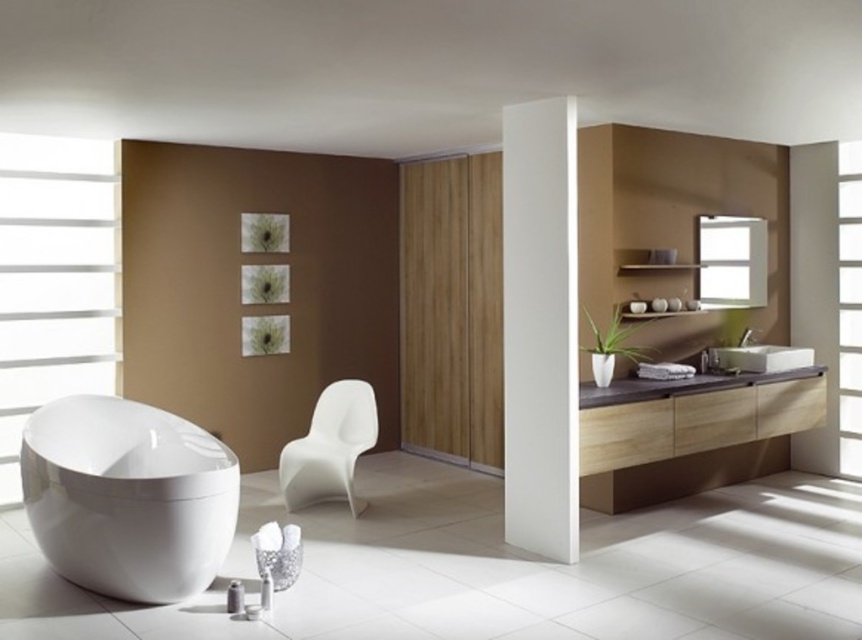
You are designing a bathroom and want to place a large potted plant in the room. Considering the white matte window at left and the transparent glass window at upper right, which window should you place the plant near to ensure it gets more sunlight?

The transparent glass window at upper right allows more sunlight since it is transparent, while the white matte window at left may block some light due to its matte finish. However, the white matte window at left is larger in size, potentially providing a broader area for light distribution. To determine the best location, consider the plant species and its light requirements. If it requires direct sunlight, the transparent glass window at upper right is preferable. If it thrives in indirect or diffused 1.

You are standing in the bathroom and want to let more natural light into the room. Which window, the white matte window at left or the transparent glass window at upper right, should you open to achieve this?

The transparent glass window at upper right should be opened to let in more natural light since it is positioned further away from the viewer compared to the white matte window at left, allowing more light to enter the room.